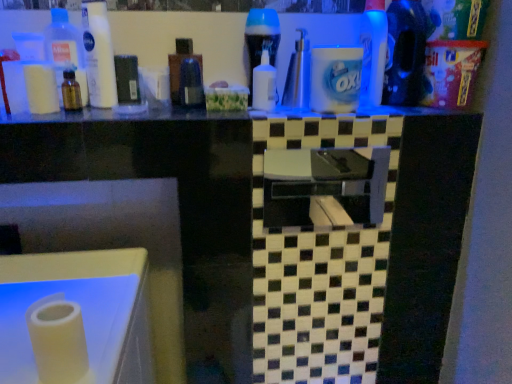
What are the coordinates of `free space in front of transparent plastic bottle at center, the fourth bottle from the right` in the screenshot? It's located at (161, 117).